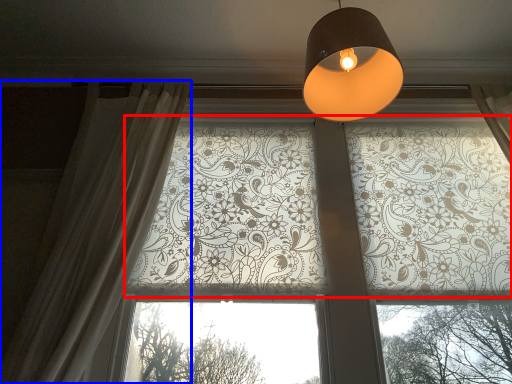
Question: Which of the following is the closest to the observer, bay window (highlighted by a red box) or curtain (highlighted by a blue box)?

Choices:
 (A) bay window
 (B) curtain

Answer: (B)